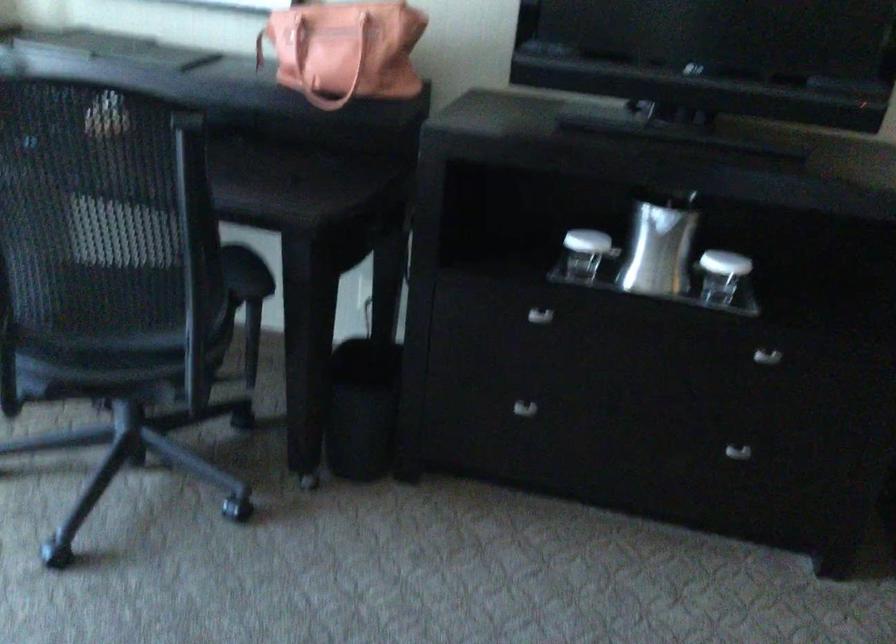
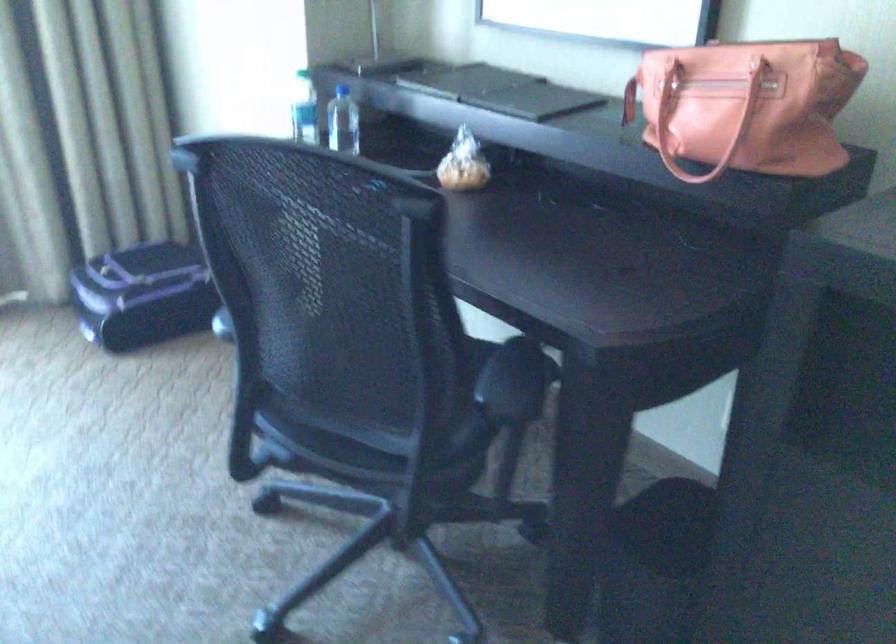
The point at (126, 346) is marked in the first image. Where is the corresponding point in the second image?

(364, 440)